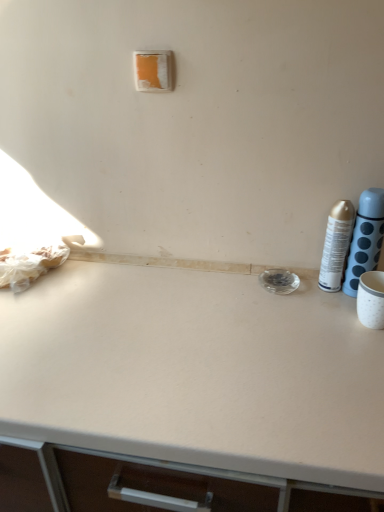
Question: Is the surface of silver metallic can at right, placed as the 2th bottle when sorted from right to left, in direct contact with metallic silver spray can at right, acting as the 2th bottle starting from the left?

Choices:
 (A) yes
 (B) no

Answer: (A)

Question: Does silver metallic can at right, which appears as the first bottle when viewed from the left, contain metallic silver spray can at right, positioned as the first bottle in right-to-left order?

Choices:
 (A) no
 (B) yes

Answer: (A)

Question: Does silver metallic can at right, which appears as the first bottle when viewed from the left, have a lesser width compared to metallic silver spray can at right, acting as the 2th bottle starting from the left?

Choices:
 (A) no
 (B) yes

Answer: (B)

Question: Is silver metallic can at right, which appears as the first bottle when viewed from the left, positioned in front of metallic silver spray can at right, acting as the 2th bottle starting from the left?

Choices:
 (A) no
 (B) yes

Answer: (A)

Question: Does silver metallic can at right, which appears as the first bottle when viewed from the left, have a greater width compared to metallic silver spray can at right, acting as the 2th bottle starting from the left?

Choices:
 (A) no
 (B) yes

Answer: (A)

Question: From their relative heights in the image, would you say silver metallic can at right, which appears as the first bottle when viewed from the left, is taller or shorter than metallic silver spray can at right, acting as the 2th bottle starting from the left?

Choices:
 (A) tall
 (B) short

Answer: (B)

Question: Considering their positions, is silver metallic can at right, placed as the 2th bottle when sorted from right to left, located in front of or behind metallic silver spray can at right, positioned as the first bottle in right-to-left order?

Choices:
 (A) behind
 (B) front

Answer: (A)

Question: Considering the positions of point (336, 258) and point (367, 225), is point (336, 258) closer or farther from the camera than point (367, 225)?

Choices:
 (A) closer
 (B) farther

Answer: (B)

Question: From a real-world perspective, relative to metallic silver spray can at right, acting as the 2th bottle starting from the left, is silver metallic can at right, which appears as the first bottle when viewed from the left, vertically above or below?

Choices:
 (A) below
 (B) above

Answer: (A)

Question: Is point [367, 210] closer or farther from the camera than point [142, 56]?

Choices:
 (A) farther
 (B) closer

Answer: (A)

Question: Is metallic silver spray can at right, positioned as the first bottle in right-to-left order, spatially inside orange matte/light switch at upper center, or outside of it?

Choices:
 (A) outside
 (B) inside

Answer: (A)

Question: Based on their sizes in the image, would you say metallic silver spray can at right, positioned as the first bottle in right-to-left order, is bigger or smaller than orange matte/light switch at upper center?

Choices:
 (A) big
 (B) small

Answer: (A)

Question: Considering the positions of metallic silver spray can at right, acting as the 2th bottle starting from the left, and orange matte/light switch at upper center in the image, is metallic silver spray can at right, acting as the 2th bottle starting from the left, wider or thinner than orange matte/light switch at upper center?

Choices:
 (A) thin
 (B) wide

Answer: (B)

Question: Do you think orange matte/light switch at upper center is within silver metallic can at right, which appears as the first bottle when viewed from the left, or outside of it?

Choices:
 (A) outside
 (B) inside

Answer: (A)

Question: From a real-world perspective, is orange matte/light switch at upper center physically located above or below silver metallic can at right, which appears as the first bottle when viewed from the left?

Choices:
 (A) above
 (B) below

Answer: (A)